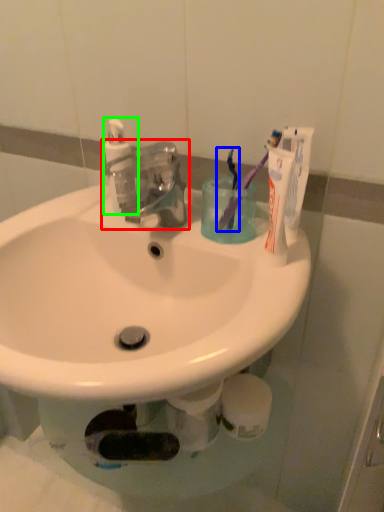
Question: Estimate the real-world distances between objects in this image. Which object is farther from tap (highlighted by a red box), toothbrush (highlighted by a blue box) or soap dispenser (highlighted by a green box)?

Choices:
 (A) toothbrush
 (B) soap dispenser

Answer: (A)